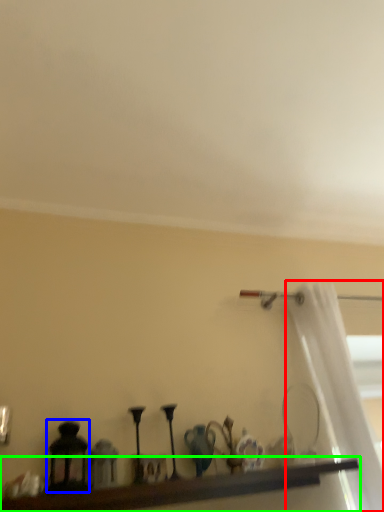
Question: Which object is the closest to the curtain (highlighted by a red box)? Choose among these: candle holder (highlighted by a blue box) or shelf (highlighted by a green box).

Choices:
 (A) candle holder
 (B) shelf

Answer: (B)